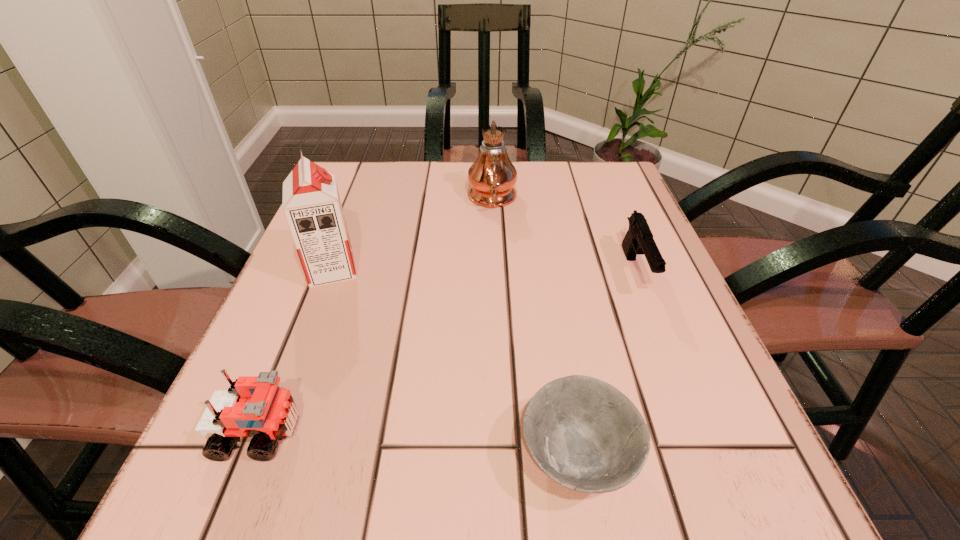
You are a GUI agent. You are given a task and a screenshot of the screen. Output one action in this format:
    pyautogui.click(x=<x>, y=<y>)
    Task: Click on the free space that is in between the shortest object and the Lego
    
    Given the screenshot: What is the action you would take?
    pyautogui.click(x=419, y=445)

The height and width of the screenshot is (540, 960). Find the location of `vacant area that lies between the Lego and the tallest object`. vacant area that lies between the Lego and the tallest object is located at coordinates (376, 315).

In order to click on vacant space that is in between the tallest object and the Lego in this screenshot , I will do `click(376, 315)`.

At what (x,y) coordinates should I click in order to perform the action: click on free space between the rightmost object and the Lego. Please return your answer as a coordinate pair (x, y). The width and height of the screenshot is (960, 540). Looking at the image, I should click on (447, 352).

This screenshot has width=960, height=540. Identify the location of vacant space in between the farthest object and the bowl. (535, 328).

Find the location of a particular element. the closest object to the soya milk is located at coordinates (492, 176).

Locate which object ranks fourth in proximity to the oil lamp. Please provide its 2D coordinates. Your answer should be formatted as a tuple, i.e. [(x, y)], where the tuple contains the x and y coordinates of a point satisfying the conditions above.

[(255, 406)]

The image size is (960, 540). In order to click on vacant space that satisfies the following two spatial constraints: 1. on the front-facing side of the Lego; 2. on the right side of the shortest object in this screenshot , I will do `click(250, 458)`.

Where is `free point that satisfies the following two spatial constraints: 1. on the front-facing side of the shortest object; 2. on the right side of the Lego`? The width and height of the screenshot is (960, 540). free point that satisfies the following two spatial constraints: 1. on the front-facing side of the shortest object; 2. on the right side of the Lego is located at coordinates (250, 458).

I want to click on free location that satisfies the following two spatial constraints: 1. on the front-facing side of the pistol; 2. on the front-facing side of the Lego, so 699,432.